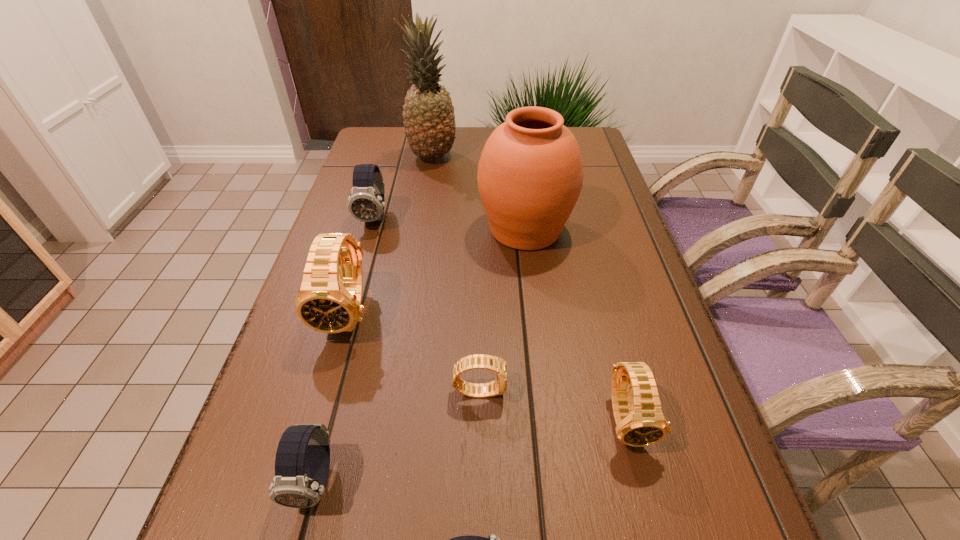
Where is `free space between the leftmost black watch and the second black watch from right to left`? Image resolution: width=960 pixels, height=540 pixels. free space between the leftmost black watch and the second black watch from right to left is located at coordinates (415, 351).

I want to click on empty location between the tallest watch and the second smallest dark watch, so click(333, 396).

Find the location of a particular element. The image size is (960, 540). free space between the seventh shortest object and the rightmost black watch is located at coordinates (576, 325).

I want to click on vacant space that is in between the second tallest object and the second black watch from left to right, so click(502, 309).

You are a GUI agent. You are given a task and a screenshot of the screen. Output one action in this format:
    pyautogui.click(x=<x>, y=<y>)
    Task: Click on the object that is the closest one to the smallest black watch
    
    Given the screenshot: What is the action you would take?
    pyautogui.click(x=640, y=422)

Locate an element on the screen. object that is the second closest to the fourth farthest object is located at coordinates (477, 361).

Identify which watch is the closest to the urn. Please provide its 2D coordinates. Your answer should be formatted as a tuple, i.e. [(x, y)], where the tuple contains the x and y coordinates of a point satisfying the conditions above.

[(329, 301)]

Identify which watch is the nearest to the third tallest object. Please provide its 2D coordinates. Your answer should be formatted as a tuple, i.e. [(x, y)], where the tuple contains the x and y coordinates of a point satisfying the conditions above.

[(366, 203)]

Where is `black watch identified as the second closest to the sixth shortest object`? black watch identified as the second closest to the sixth shortest object is located at coordinates (640, 422).

Locate an element on the screen. The width and height of the screenshot is (960, 540). black watch that stands as the closest to the farthest dark watch is located at coordinates (329, 301).